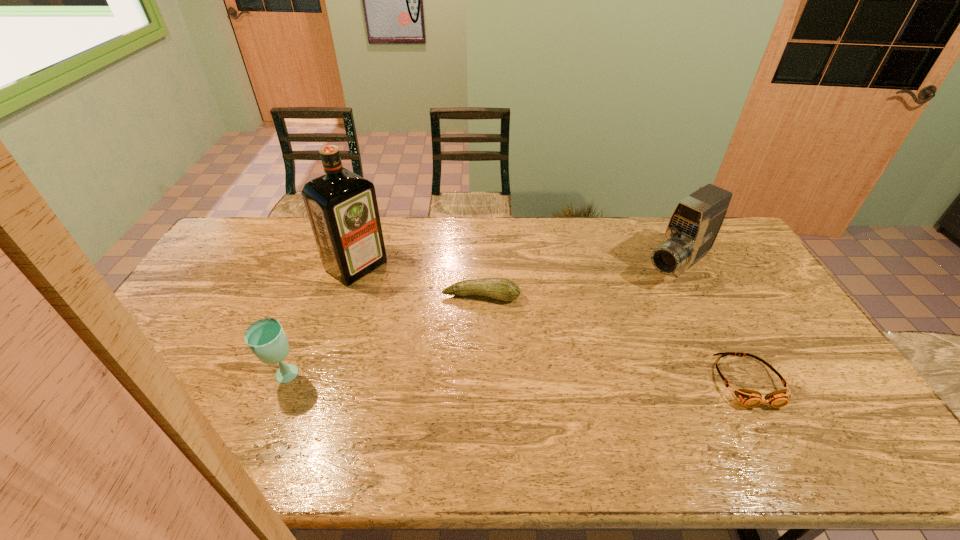
The width and height of the screenshot is (960, 540). What are the coordinates of `vacant region located at the stem end of the third object from left to right` in the screenshot? It's located at (468, 342).

Image resolution: width=960 pixels, height=540 pixels. Identify the location of vacant space located 0.250m at the stem end of the third object from left to right. (463, 370).

Locate an element on the screen. free location located at the stem end of the third object from left to right is located at coordinates (465, 359).

Locate an element on the screen. Image resolution: width=960 pixels, height=540 pixels. vacant space located on the front label of the tallest object is located at coordinates (447, 327).

Where is `vacant space located on the front label of the tallest object`? Image resolution: width=960 pixels, height=540 pixels. vacant space located on the front label of the tallest object is located at coordinates (444, 326).

This screenshot has height=540, width=960. I want to click on free location located on the front label of the tallest object, so click(421, 310).

Image resolution: width=960 pixels, height=540 pixels. In order to click on camcorder present at the far edge in this screenshot , I will do `click(694, 224)`.

Where is `liquor present at the far edge`? The width and height of the screenshot is (960, 540). liquor present at the far edge is located at coordinates (342, 207).

Where is `object that is at the near edge`? Image resolution: width=960 pixels, height=540 pixels. object that is at the near edge is located at coordinates (750, 398).

This screenshot has width=960, height=540. In order to click on object that is at the right edge in this screenshot , I will do `click(694, 224)`.